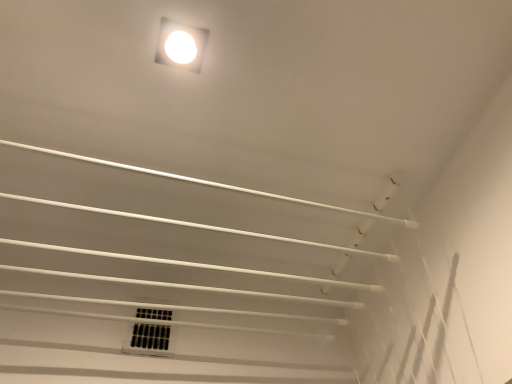
Locate an element on the screen. The image size is (512, 384). white glossy light fixture at upper center is located at coordinates (181, 45).

What do you see at coordinates (181, 45) in the screenshot?
I see `white glossy light fixture at upper center` at bounding box center [181, 45].

Describe the element at coordinates (149, 339) in the screenshot. I see `white plastic vent at center` at that location.

Where is `white plastic vent at center`? The height and width of the screenshot is (384, 512). white plastic vent at center is located at coordinates (149, 339).

The width and height of the screenshot is (512, 384). Identify the location of white glossy light fixture at upper center. (181, 45).

Considering the relative positions of white glossy light fixture at upper center and white plastic vent at center in the image provided, is white glossy light fixture at upper center to the right of white plastic vent at center from the viewer's perspective?

Yes, white glossy light fixture at upper center is to the right of white plastic vent at center.

From the picture: Which object is more forward, white glossy light fixture at upper center or white plastic vent at center?

Positioned in front is white glossy light fixture at upper center.

Which is less distant, (x=207, y=30) or (x=144, y=314)?

The point (x=207, y=30) is closer.

From the image's perspective, between white glossy light fixture at upper center and white plastic vent at center, who is located below?

white plastic vent at center, from the image's perspective.

From a real-world perspective, is white glossy light fixture at upper center under white plastic vent at center?

No, from a real-world perspective, white glossy light fixture at upper center is not below white plastic vent at center.

Does white glossy light fixture at upper center have a greater width compared to white plastic vent at center?

Indeed, white glossy light fixture at upper center has a greater width compared to white plastic vent at center.

Between white glossy light fixture at upper center and white plastic vent at center, which one has more height?

With more height is white plastic vent at center.

Is white glossy light fixture at upper center bigger than white plastic vent at center?

Actually, white glossy light fixture at upper center might be smaller than white plastic vent at center.

Is white glossy light fixture at upper center surrounding white plastic vent at center?

No, white plastic vent at center is not a part of white glossy light fixture at upper center.

Is white glossy light fixture at upper center in contact with white plastic vent at center?

No, white glossy light fixture at upper center is not making contact with white plastic vent at center.

Is white glossy light fixture at upper center oriented away from white plastic vent at center?

No, white plastic vent at center is not at the back of white glossy light fixture at upper center.

How different are the orientations of white glossy light fixture at upper center and white plastic vent at center in degrees?

2.12 degrees separate the facing orientations of white glossy light fixture at upper center and white plastic vent at center.

Where is `lamp in front of the white plastic vent at center`? This screenshot has height=384, width=512. lamp in front of the white plastic vent at center is located at coordinates (181, 45).

Does white plastic vent at center appear on the right side of white glossy light fixture at upper center?

In fact, white plastic vent at center is to the left of white glossy light fixture at upper center.

Is white plastic vent at center further to camera compared to white glossy light fixture at upper center?

Yes, it is behind white glossy light fixture at upper center.

Which point is more forward, (138, 344) or (156, 53)?

Point (156, 53)

From the image's perspective, is white plastic vent at center over white glossy light fixture at upper center?

No, from the image's perspective, white plastic vent at center is not over white glossy light fixture at upper center.

From a real-world perspective, which is physically above, white plastic vent at center or white glossy light fixture at upper center?

white glossy light fixture at upper center, from a real-world perspective.

Which object is wider, white plastic vent at center or white glossy light fixture at upper center?

white glossy light fixture at upper center is wider.

Between white plastic vent at center and white glossy light fixture at upper center, which one has more height?

With more height is white plastic vent at center.

Looking at this image, does white plastic vent at center have a smaller size compared to white glossy light fixture at upper center?

No, white plastic vent at center is not smaller than white glossy light fixture at upper center.

Is white glossy light fixture at upper center inside white plastic vent at center?

No.

Would you consider white plastic vent at center to be distant from white glossy light fixture at upper center?

No, white plastic vent at center is not far from white glossy light fixture at upper center.

Is white plastic vent at center oriented away from white glossy light fixture at upper center?

white plastic vent at center does not have its back to white glossy light fixture at upper center.

How far apart are white plastic vent at center and white glossy light fixture at upper center?

They are 28.91 inches apart.

Where is `lamp on the right side of white plastic vent at center`? The image size is (512, 384). lamp on the right side of white plastic vent at center is located at coordinates (181, 45).

At what (x,y) coordinates should I click in order to perform the action: click on lamp located in front of the white plastic vent at center. Please return your answer as a coordinate pair (x, y). Image resolution: width=512 pixels, height=384 pixels. Looking at the image, I should click on (181, 45).

I want to click on lamp located above the white plastic vent at center (from the image's perspective), so click(x=181, y=45).